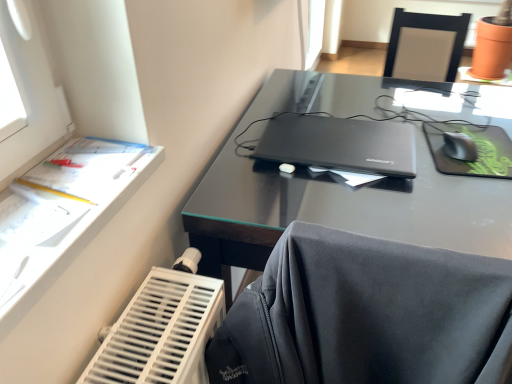
Question: Does matte black laptop at center have a smaller size compared to white paper at left?

Choices:
 (A) yes
 (B) no

Answer: (A)

Question: Does matte black laptop at center have a greater width compared to white paper at left?

Choices:
 (A) yes
 (B) no

Answer: (A)

Question: Considering the relative sizes of matte black laptop at center and white paper at left in the image provided, is matte black laptop at center thinner than white paper at left?

Choices:
 (A) no
 (B) yes

Answer: (A)

Question: Is white paper at left at the back of matte black laptop at center?

Choices:
 (A) no
 (B) yes

Answer: (A)

Question: From a real-world perspective, is matte black laptop at center located beneath white paper at left?

Choices:
 (A) yes
 (B) no

Answer: (A)

Question: Would you say black plastic mouse at right is inside or outside white paper at left?

Choices:
 (A) outside
 (B) inside

Answer: (A)

Question: In terms of height, does black plastic mouse at right look taller or shorter compared to white paper at left?

Choices:
 (A) short
 (B) tall

Answer: (A)

Question: From the image's perspective, relative to white paper at left, is black plastic mouse at right above or below?

Choices:
 (A) below
 (B) above

Answer: (B)

Question: In terms of width, does black plastic mouse at right look wider or thinner when compared to white paper at left?

Choices:
 (A) thin
 (B) wide

Answer: (A)

Question: Relative to black matte mouse pad at right, is glossy black desk at center in front or behind?

Choices:
 (A) behind
 (B) front

Answer: (B)

Question: Based on their sizes in the image, would you say glossy black desk at center is bigger or smaller than black matte mouse pad at right?

Choices:
 (A) big
 (B) small

Answer: (A)

Question: Do you think glossy black desk at center is within black matte mouse pad at right, or outside of it?

Choices:
 (A) inside
 (B) outside

Answer: (B)

Question: Does point (362, 215) appear closer or farther from the camera than point (501, 165)?

Choices:
 (A) farther
 (B) closer

Answer: (B)

Question: In terms of size, does black plastic mouse at right appear bigger or smaller than glossy black desk at center?

Choices:
 (A) big
 (B) small

Answer: (B)

Question: In the image, is black plastic mouse at right on the left side or the right side of glossy black desk at center?

Choices:
 (A) right
 (B) left

Answer: (A)